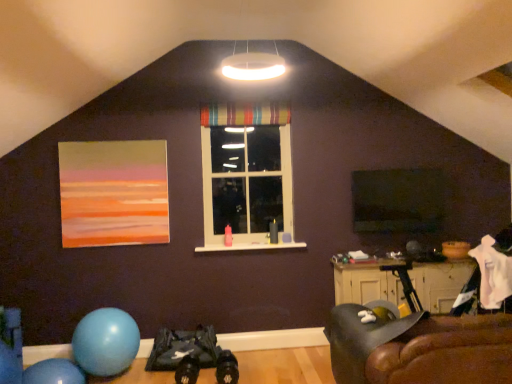
This screenshot has height=384, width=512. What do you see at coordinates (365, 284) in the screenshot? I see `wooden cabinet at lower right` at bounding box center [365, 284].

Measure the distance between transparent plastic window screen at center and camera.

The distance of transparent plastic window screen at center from camera is 4.28 meters.

Identify the location of leather couch at lower right. This screenshot has width=512, height=384. (419, 349).

You are a GUI agent. You are given a task and a screenshot of the screen. Output one action in this format:
    pyautogui.click(x=<x>, y=<y>)
    Task: Click on the curtain above the striped fabric window at center (from the image's perspective)
    The height and width of the screenshot is (384, 512).
    Given the screenshot: What is the action you would take?
    pyautogui.click(x=244, y=115)

From a real-world perspective, is striped fabric curtain at upper center over striped fabric window at center?

Correct, in the physical world, striped fabric curtain at upper center is higher than striped fabric window at center.

Looking at this image, can you confirm if striped fabric curtain at upper center is smaller than striped fabric window at center?

Yes, striped fabric curtain at upper center is smaller than striped fabric window at center.

In the image, is striped fabric curtain at upper center positioned in front of or behind striped fabric window at center?

In the image, striped fabric curtain at upper center appears in front of striped fabric window at center.

Which is in front, point (205, 119) or point (463, 367)?

The point (463, 367) is closer to the camera.

In the scene shown: Is striped fabric curtain at upper center positioned before leather couch at lower right?

No, it is behind leather couch at lower right.

Can we say striped fabric curtain at upper center lies outside leather couch at lower right?

Yes, striped fabric curtain at upper center is located beyond the bounds of leather couch at lower right.

Does striped fabric curtain at upper center have a lesser height compared to leather couch at lower right?

Yes, striped fabric curtain at upper center is shorter than leather couch at lower right.

Which of these two, transparent plastic window screen at center or striped fabric curtain at upper center, stands shorter?

striped fabric curtain at upper center.

Does transparent plastic window screen at center appear on the right side of striped fabric curtain at upper center?

Correct, you'll find transparent plastic window screen at center to the right of striped fabric curtain at upper center.

The width and height of the screenshot is (512, 384). In order to click on curtain lying behind the transparent plastic window screen at center in this screenshot , I will do `click(244, 115)`.

Would you say transparent plastic window screen at center is inside or outside matte acrylic painting at upper left?

transparent plastic window screen at center is spatially situated outside matte acrylic painting at upper left.

How far apart are transparent plastic window screen at center and matte acrylic painting at upper left?

transparent plastic window screen at center and matte acrylic painting at upper left are 7.80 feet apart.

Can you confirm if transparent plastic window screen at center is bigger than matte acrylic painting at upper left?

Incorrect, transparent plastic window screen at center is not larger than matte acrylic painting at upper left.

Based on the photo, can you tell me how much transparent plastic window screen at center and matte acrylic painting at upper left differ in facing direction?

They differ by 0.905 degrees in their facing directions.

Can we say striped fabric curtain at upper center lies outside transparent plastic window screen at center?

striped fabric curtain at upper center is positioned outside transparent plastic window screen at center.

Is point (266, 113) more distant than point (443, 214)?

Yes, point (266, 113) is farther from viewer.

Are striped fabric curtain at upper center and transparent plastic window screen at center beside each other?

No, striped fabric curtain at upper center is not with transparent plastic window screen at center.

Can you confirm if striped fabric curtain at upper center is bigger than transparent plastic window screen at center?

Incorrect, striped fabric curtain at upper center is not larger than transparent plastic window screen at center.

Is blue rubber balloon at lower left placed right next to leather couch at lower right?

No.

From the image's perspective, is blue rubber balloon at lower left positioned above or below leather couch at lower right?

Clearly, from the image's perspective, blue rubber balloon at lower left is below leather couch at lower right.

Consider the image. Could you tell me if blue rubber balloon at lower left is turned towards leather couch at lower right?

No, blue rubber balloon at lower left is not aimed at leather couch at lower right.

Considering the relative positions of wooden cabinet at lower right and leather couch at lower right in the image provided, is wooden cabinet at lower right to the left of leather couch at lower right from the viewer's perspective?

No, wooden cabinet at lower right is not to the left of leather couch at lower right.

Is leather couch at lower right a part of wooden cabinet at lower right?

That's incorrect, leather couch at lower right is not inside wooden cabinet at lower right.

Who is smaller, wooden cabinet at lower right or leather couch at lower right?

wooden cabinet at lower right is smaller.

The image size is (512, 384). I want to click on window located behind the striped fabric curtain at upper center, so click(246, 174).

This screenshot has height=384, width=512. In order to click on studio couch below the striped fabric curtain at upper center (from the image's perspective) in this screenshot , I will do click(x=419, y=349).

Looking at the image, which one is located further to wooden cabinet at lower right, leather couch at lower right or striped fabric window at center?

The object further to wooden cabinet at lower right is striped fabric window at center.

Looking at this image, based on their spatial positions, is transparent plastic window screen at center or blue rubber balloon at lower left closer to striped fabric window at center?

Based on the image, transparent plastic window screen at center appears to be nearer to striped fabric window at center.

Looking at the image, which one is located closer to leather couch at lower right, striped fabric window at center or wooden cabinet at lower right?

wooden cabinet at lower right is positioned closer to the anchor leather couch at lower right.

Which object lies nearer to the anchor point wooden cabinet at lower right, blue rubber balloon at lower left or matte acrylic painting at upper left?

Among the two, blue rubber balloon at lower left is located nearer to wooden cabinet at lower right.

Which object lies nearer to the anchor point leather couch at lower right, wooden cabinet at lower right or striped fabric window at center?

Based on the image, wooden cabinet at lower right appears to be nearer to leather couch at lower right.

Based on their spatial positions, is striped fabric curtain at upper center or wooden cabinet at lower right closer to leather couch at lower right?

wooden cabinet at lower right.

Based on their spatial positions, is leather couch at lower right or striped fabric curtain at upper center further from blue rubber balloon at lower left?

Based on the image, striped fabric curtain at upper center appears to be further to blue rubber balloon at lower left.

From the image, which object appears to be farther from striped fabric curtain at upper center, striped fabric window at center or matte acrylic painting at upper left?

matte acrylic painting at upper left.

Identify the location of window situated between blue rubber balloon at lower left and wooden cabinet at lower right from left to right. Image resolution: width=512 pixels, height=384 pixels. (246, 174).

What are the coordinates of `window situated between striped fabric curtain at upper center and transparent plastic window screen at center from left to right` in the screenshot? It's located at (246, 174).

This screenshot has height=384, width=512. Identify the location of studio couch between blue rubber balloon at lower left and wooden cabinet at lower right in the horizontal direction. (419, 349).

Locate an element on the screen. window screen between leather couch at lower right and striped fabric curtain at upper center in the front-back direction is located at coordinates (398, 200).